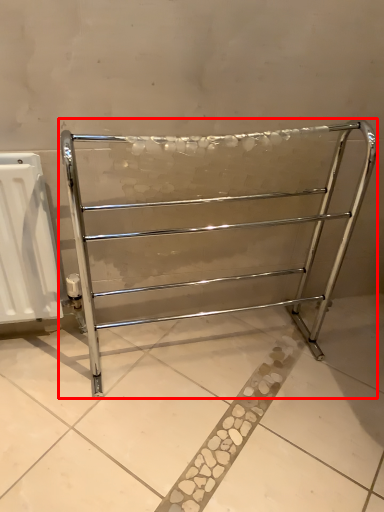
Question: From the image, what is the correct spatial relationship of furniture (annotated by the red box) in relation to radiator?

Choices:
 (A) right
 (B) left

Answer: (A)